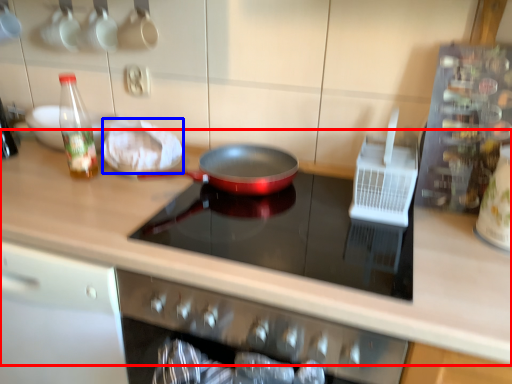
Question: Which object is further to the camera taking this photo, countertop (highlighted by a red box) or food (highlighted by a blue box)?

Choices:
 (A) countertop
 (B) food

Answer: (B)